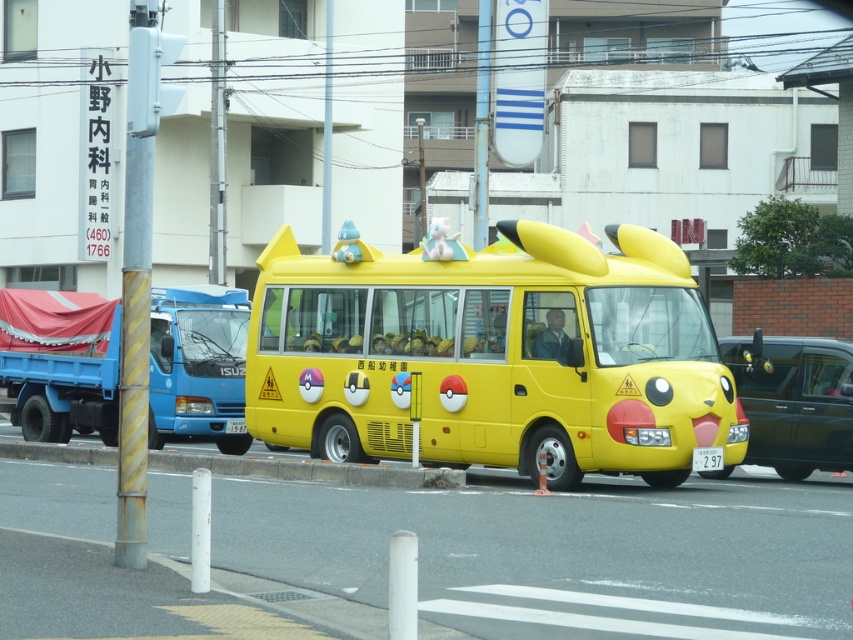
Is yellow matte school bus at center below blue metallic truck at left?

Yes.

Can you confirm if yellow matte school bus at center is wider than blue metallic truck at left?

In fact, yellow matte school bus at center might be narrower than blue metallic truck at left.

Find the location of a particular element. yellow matte school bus at center is located at coordinates point(492,355).

Who is lower down, blue metallic truck at left or white plastic license plate at center?

white plastic license plate at center

Based on the photo, can you confirm if blue metallic truck at left is positioned to the left of white plastic license plate at center?

Indeed, blue metallic truck at left is positioned on the left side of white plastic license plate at center.

Which is behind, point (230, 308) or point (717, 468)?

The point (230, 308) is behind.

Locate an element on the screen. blue metallic truck at left is located at coordinates (198, 364).

Does yellow matte school bus at center come in front of shiny black car at right?

No.

Who is more distant from viewer, (450, 408) or (817, 440)?

Point (817, 440)

Locate an element on the screen. The width and height of the screenshot is (853, 640). yellow matte school bus at center is located at coordinates (492, 355).